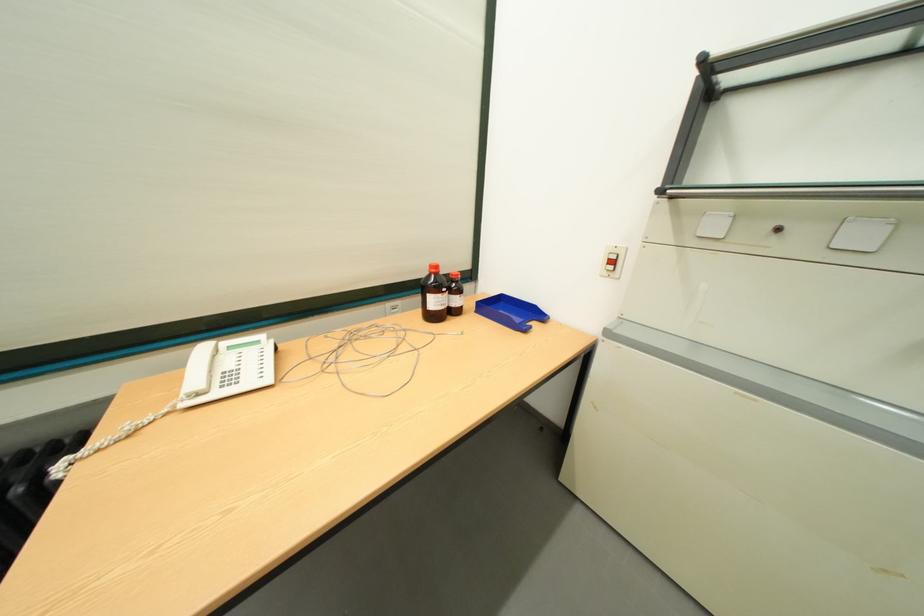
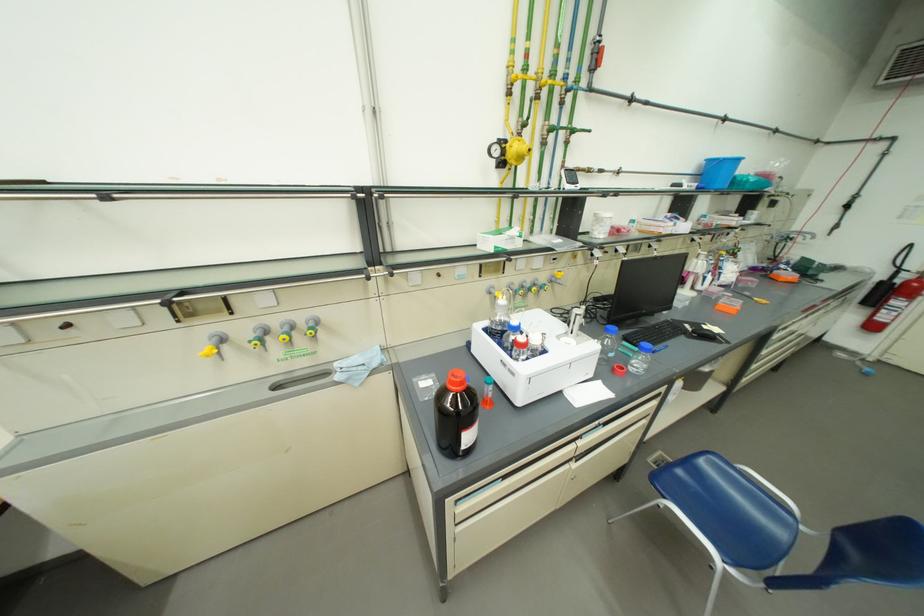
First-person continuous shooting, in which direction is the camera rotating?

The camera rotated toward right-down.